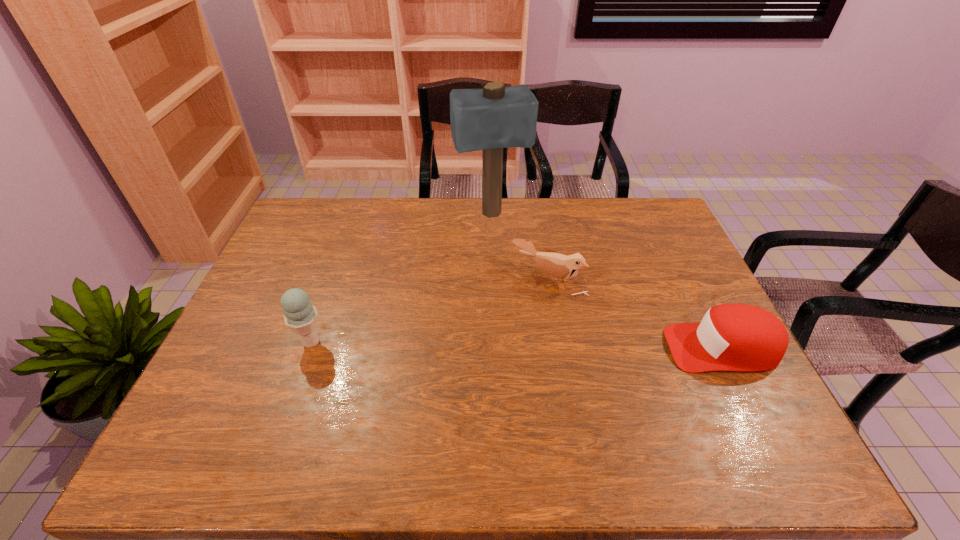
Where is `the leftmost object`? The image size is (960, 540). the leftmost object is located at coordinates (300, 315).

Where is `the third shortest object`? The width and height of the screenshot is (960, 540). the third shortest object is located at coordinates (300, 315).

Find the location of a particular element. Image resolution: width=960 pixels, height=540 pixels. baseball cap is located at coordinates (731, 337).

The width and height of the screenshot is (960, 540). I want to click on the tallest object, so click(495, 117).

Where is `mallet`? mallet is located at coordinates (495, 117).

Find the location of a particular element. the third nearest object is located at coordinates (556, 265).

In order to click on vacant space located 0.170m on the back of the ice cream in this screenshot , I will do `click(331, 286)`.

In order to click on free space located on the front-facing side of the baseball cap in this screenshot , I will do `click(647, 348)`.

Locate an element on the screen. The width and height of the screenshot is (960, 540). vacant space positioned on the front-facing side of the baseball cap is located at coordinates (602, 348).

This screenshot has width=960, height=540. I want to click on free region located 0.230m on the front-facing side of the baseball cap, so click(x=579, y=348).